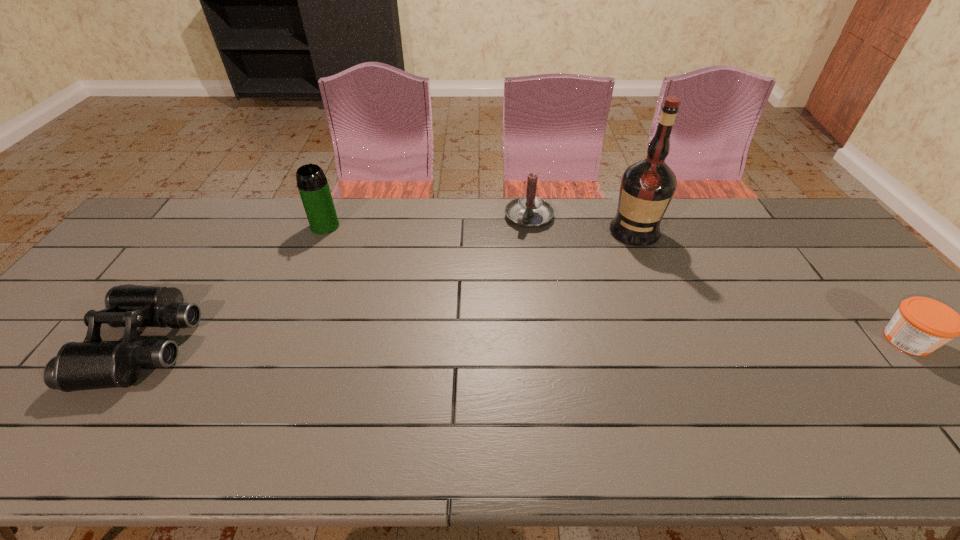
Where is `binoculars`? binoculars is located at coordinates [92, 364].

Image resolution: width=960 pixels, height=540 pixels. What are the coordinates of `the shortest object` in the screenshot? It's located at (920, 325).

This screenshot has width=960, height=540. What are the coordinates of `the rightmost object` in the screenshot? It's located at (920, 325).

This screenshot has width=960, height=540. What are the coordinates of `the second tallest object` in the screenshot? It's located at (312, 183).

I want to click on the second object from left to right, so click(x=312, y=183).

Where is `the second object from right to left`? The image size is (960, 540). the second object from right to left is located at coordinates (647, 186).

Locate an element on the screen. The width and height of the screenshot is (960, 540). liquor is located at coordinates (647, 186).

In order to click on the third shortest object in this screenshot , I will do `click(528, 211)`.

Locate an element on the screen. candle is located at coordinates (528, 211).

Where is `vacant region located 0.060m on the front-facing side of the leftmost object`? vacant region located 0.060m on the front-facing side of the leftmost object is located at coordinates (74, 344).